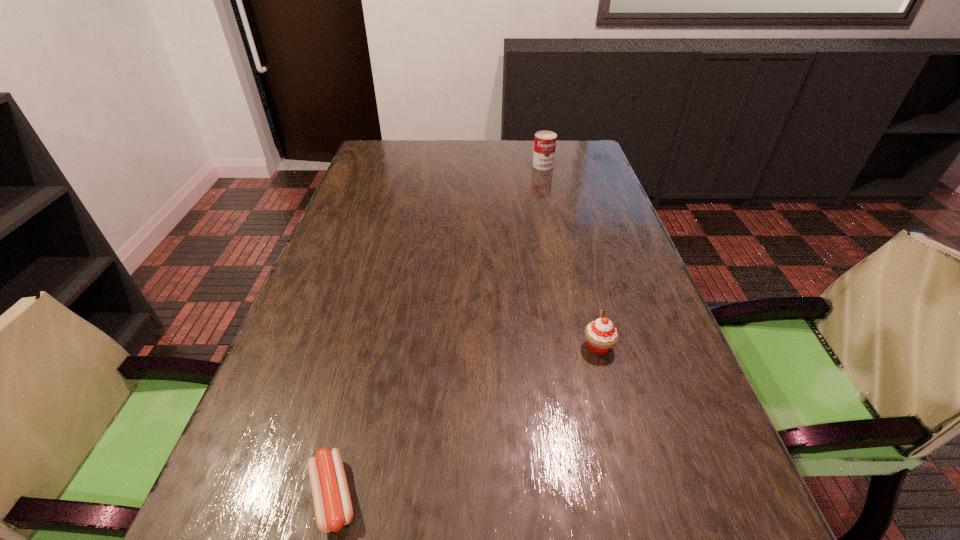
You are a GUI agent. You are given a task and a screenshot of the screen. Output one action in this format:
    pyautogui.click(x=<x>, y=<y>)
    Task: Click on the empty space between the nearest object and the cupcake
    This screenshot has height=540, width=960.
    Given the screenshot: What is the action you would take?
    pyautogui.click(x=466, y=421)

Where is `free area in between the nearest object and the tallest object`? Image resolution: width=960 pixels, height=540 pixels. free area in between the nearest object and the tallest object is located at coordinates (438, 330).

Image resolution: width=960 pixels, height=540 pixels. What are the coordinates of `vacant area that lies between the shortest object and the second shortest object` in the screenshot? It's located at (466, 421).

Where is `empty space that is in between the nearest object and the farthest object`? This screenshot has height=540, width=960. empty space that is in between the nearest object and the farthest object is located at coordinates (438, 330).

Where is `vacant space that's between the nearest object and the farthest object`? The image size is (960, 540). vacant space that's between the nearest object and the farthest object is located at coordinates (438, 330).

Image resolution: width=960 pixels, height=540 pixels. What are the coordinates of `free spot between the cupcake and the shortest object` in the screenshot? It's located at (466, 421).

Locate an element on the screen. This screenshot has width=960, height=540. vacant area that lies between the tallest object and the second tallest object is located at coordinates (570, 256).

Point out which object is positioned as the second nearest to the leftmost object. Please provide its 2D coordinates. Your answer should be formatted as a tuple, i.e. [(x, y)], where the tuple contains the x and y coordinates of a point satisfying the conditions above.

[(545, 141)]

Locate which object is the closest to the farthest object. Please provide its 2D coordinates. Your answer should be formatted as a tuple, i.e. [(x, y)], where the tuple contains the x and y coordinates of a point satisfying the conditions above.

[(601, 335)]

The width and height of the screenshot is (960, 540). In order to click on vacant point that satisfies the following two spatial constraints: 1. on the front label of the cupcake; 2. on the right side of the tallest object in this screenshot , I will do `click(585, 346)`.